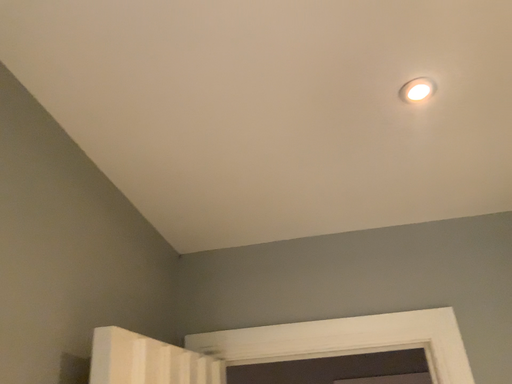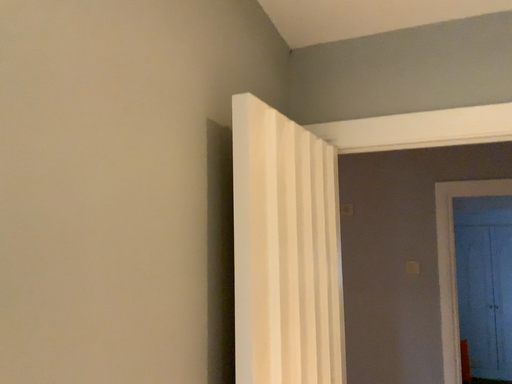
Question: How did the camera likely rotate when shooting the video?

Choices:
 (A) rotated left
 (B) rotated right

Answer: (A)